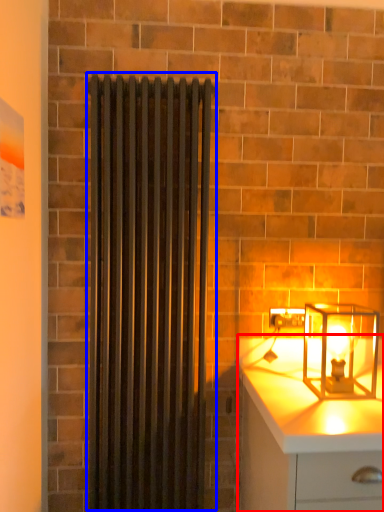
Question: Which object is closer to the camera taking this photo, chest of drawers (highlighted by a red box) or shower curtain (highlighted by a blue box)?

Choices:
 (A) chest of drawers
 (B) shower curtain

Answer: (A)